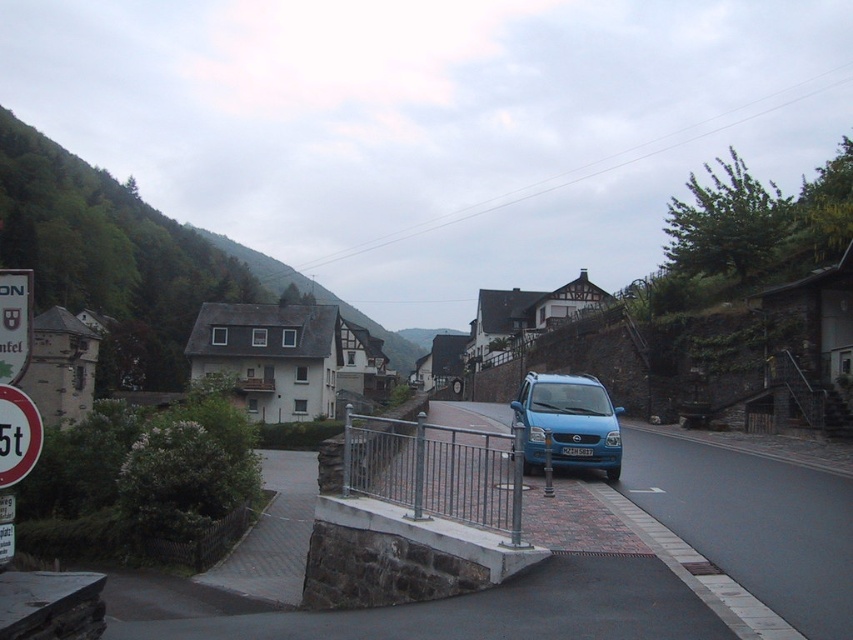
Question: Which object appears farthest from the camera in this image?

Choices:
 (A) blue matte van at center
 (B) metallic gray rail at center

Answer: (A)

Question: Is the position of metallic gray rail at center less distant than that of blue matte van at center?

Choices:
 (A) no
 (B) yes

Answer: (B)

Question: Is green leafy hillside at upper left above white plastic sign at upper left?

Choices:
 (A) yes
 (B) no

Answer: (A)

Question: Which point is farther to the camera?

Choices:
 (A) (525, 547)
 (B) (3, 336)
 (C) (28, 237)
 (D) (537, 401)

Answer: (C)

Question: From the image, what is the correct spatial relationship of metallic gray rail at center in relation to blue matte van at center?

Choices:
 (A) left
 (B) right

Answer: (A)

Question: Among these objects, which one is farthest from the camera?

Choices:
 (A) white plastic sign at upper left
 (B) green leafy hillside at upper left
 (C) metallic gray rail at center

Answer: (B)